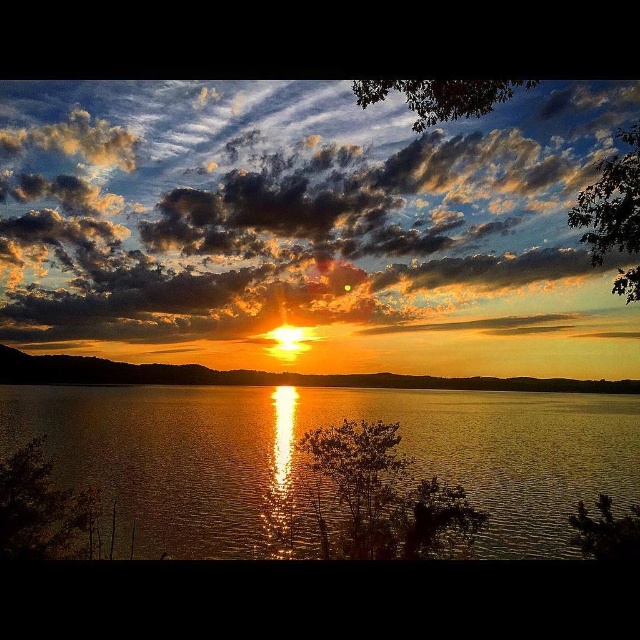
Does glistening reflective water at center have a smaller size compared to golden matte horizon at center?

Actually, glistening reflective water at center might be larger than golden matte horizon at center.

How distant is glistening reflective water at center from golden matte horizon at center?

glistening reflective water at center and golden matte horizon at center are 10.81 meters apart.

At what (x,y) coordinates should I click in order to perform the action: click on glistening reflective water at center. Please return your answer as a coordinate pair (x, y). This screenshot has width=640, height=640. Looking at the image, I should click on (310, 468).

Is cloudy sky at upper center smaller than golden matte horizon at center?

Actually, cloudy sky at upper center might be larger than golden matte horizon at center.

This screenshot has width=640, height=640. Identify the location of cloudy sky at upper center. (291, 211).

What do you see at coordinates (291, 211) in the screenshot? I see `cloudy sky at upper center` at bounding box center [291, 211].

You are a GUI agent. You are given a task and a screenshot of the screen. Output one action in this format:
    pyautogui.click(x=<x>, y=<y>)
    Task: Click on the cloudy sky at upper center
    The width and height of the screenshot is (640, 640).
    Given the screenshot: What is the action you would take?
    pyautogui.click(x=291, y=211)

In the scene shown: Does cloudy sky at upper center appear on the left side of glistening reflective water at center?

Correct, you'll find cloudy sky at upper center to the left of glistening reflective water at center.

Between cloudy sky at upper center and glistening reflective water at center, which one appears on the right side from the viewer's perspective?

glistening reflective water at center is more to the right.

The width and height of the screenshot is (640, 640). Describe the element at coordinates (291, 211) in the screenshot. I see `cloudy sky at upper center` at that location.

The image size is (640, 640). Find the location of `cloudy sky at upper center`. cloudy sky at upper center is located at coordinates pyautogui.click(x=291, y=211).